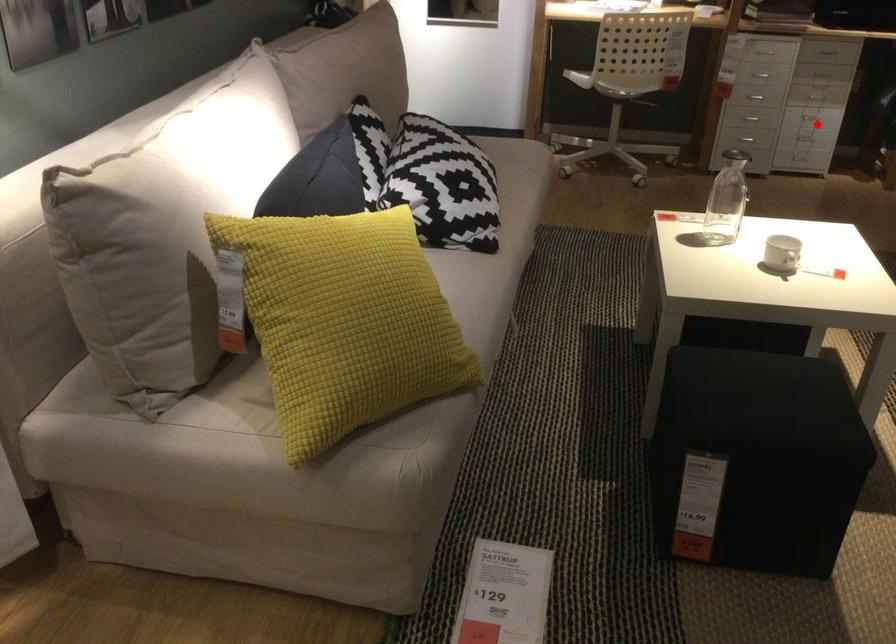
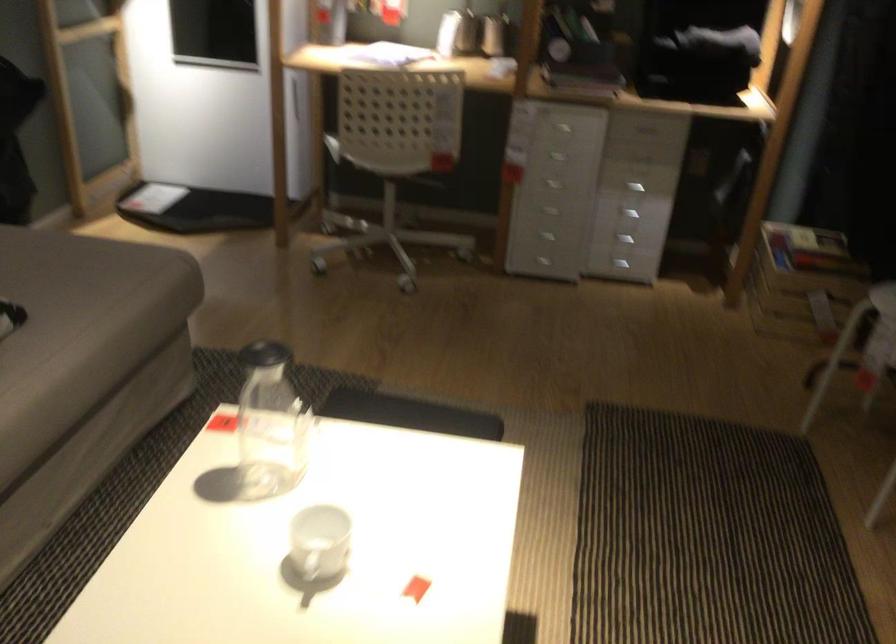
Question: I am providing you with two images of the same scene from different viewpoints. In image1, a red point is highlighted. Considering the same 3D point in image2, which of the following is correct?

Choices:
 (A) It is closer
 (B) It is farther

Answer: (A)